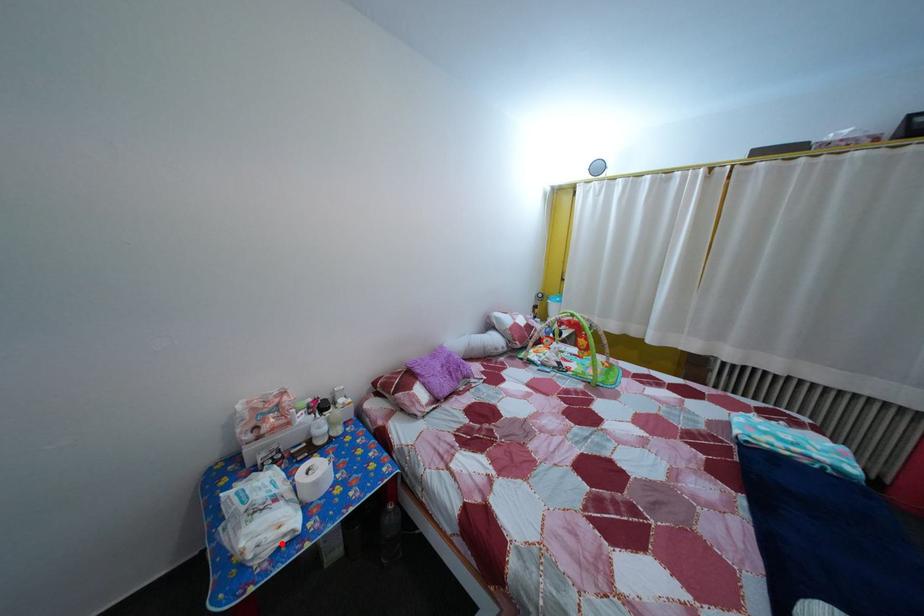
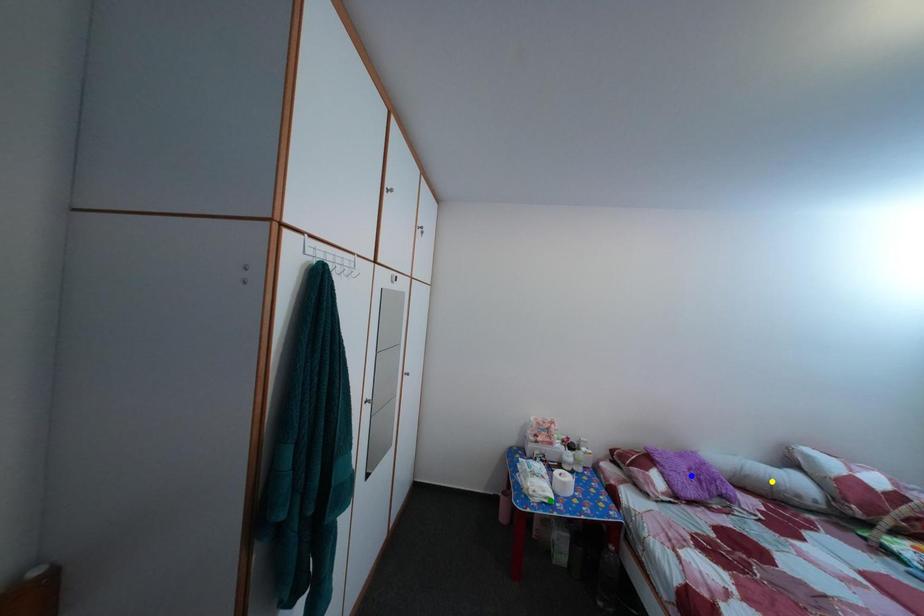
Question: I am providing you with two images of the same scene from different viewpoints. A red point is marked on the first image. You are given multiple points on the second image. Can you choose the point in image 2 that corresponds to the point in image 1?

Choices:
 (A) blue point
 (B) yellow point
 (C) green point

Answer: (C)